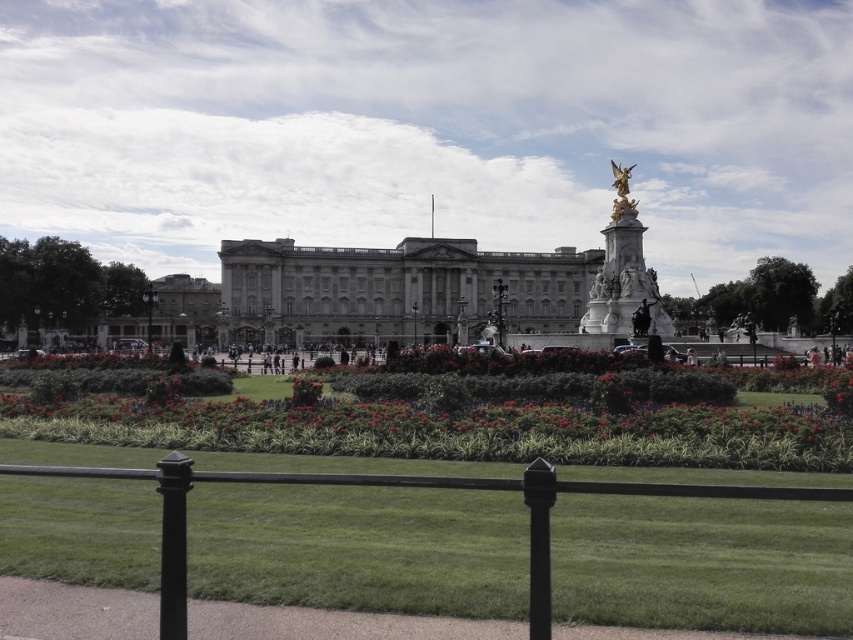
Question: Can you confirm if green grass at center is positioned below black metal fence at lower center?

Choices:
 (A) yes
 (B) no

Answer: (B)

Question: Is white stone building at center thinner than black metal fence at lower center?

Choices:
 (A) no
 (B) yes

Answer: (A)

Question: Is green grass at center above black metal fence at lower center?

Choices:
 (A) yes
 (B) no

Answer: (A)

Question: Among these points, which one is nearest to the camera?

Choices:
 (A) (762, 486)
 (B) (657, 298)
 (C) (379, 445)

Answer: (A)

Question: Which point is closer to the camera?

Choices:
 (A) (424, 476)
 (B) (831, 468)
 (C) (621, 214)

Answer: (A)

Question: Which of these objects is positioned farthest from the black metal fence at lower center?

Choices:
 (A) white stone building at center
 (B) gold polished statue at upper center

Answer: (A)